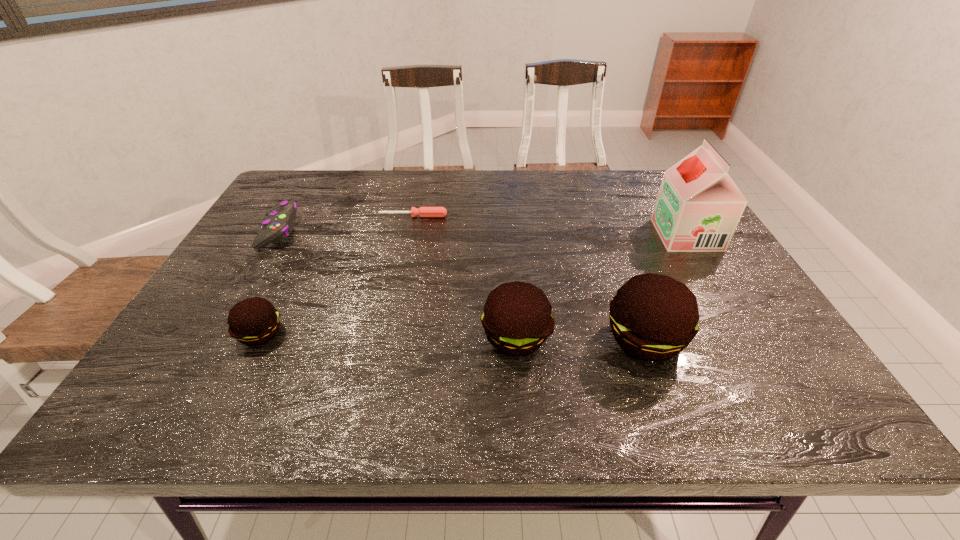
Where is `the shortest patty`? The height and width of the screenshot is (540, 960). the shortest patty is located at coordinates (254, 321).

You are a GUI agent. You are given a task and a screenshot of the screen. Output one action in this format:
    pyautogui.click(x=<x>, y=<y>)
    Task: Click on the leftmost patty
    
    Given the screenshot: What is the action you would take?
    pyautogui.click(x=254, y=321)

Identify the location of the third object from right to left. Image resolution: width=960 pixels, height=540 pixels. (517, 320).

Where is `the third tallest object`? The image size is (960, 540). the third tallest object is located at coordinates (517, 320).

The height and width of the screenshot is (540, 960). I want to click on the rightmost patty, so click(x=653, y=317).

Locate an element on the screen. screwdriver is located at coordinates (422, 211).

Identify the location of the shortest object. This screenshot has width=960, height=540. (422, 211).

This screenshot has height=540, width=960. Find the location of `the tallest object`. the tallest object is located at coordinates (698, 208).

This screenshot has height=540, width=960. In order to click on the rightmost object in this screenshot , I will do `click(698, 208)`.

The height and width of the screenshot is (540, 960). What are the coordinates of `the second shortest object` in the screenshot? It's located at (280, 221).